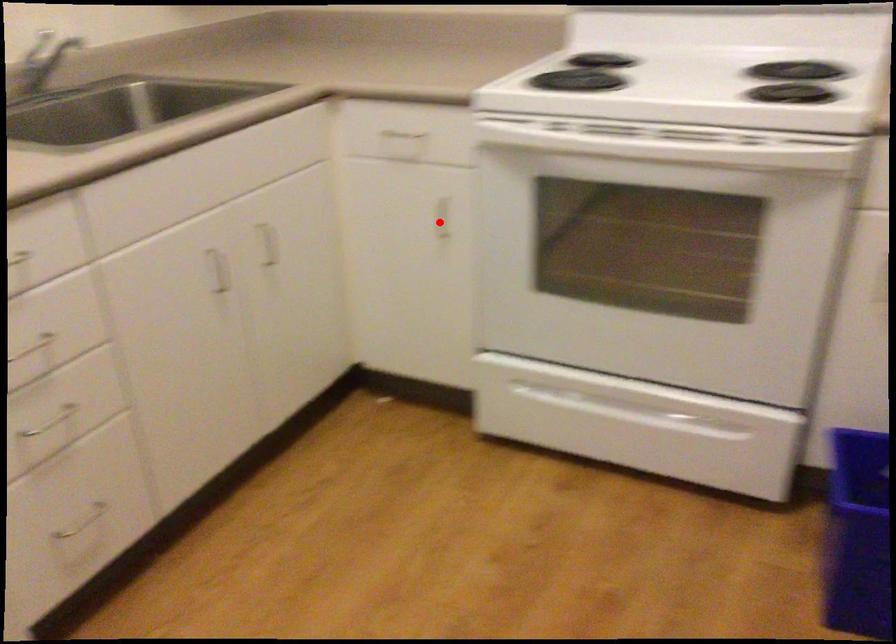
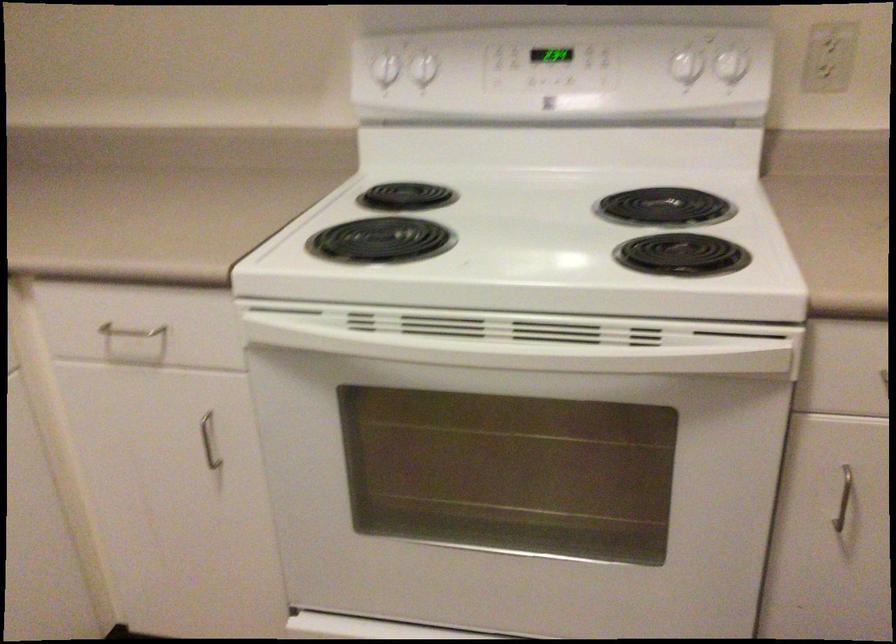
Question: I am providing you with two images of the same scene from different viewpoints. In image1, a red point is highlighted. Considering the same 3D point in image2, which of the following is correct?

Choices:
 (A) It is closer
 (B) It is farther

Answer: (A)